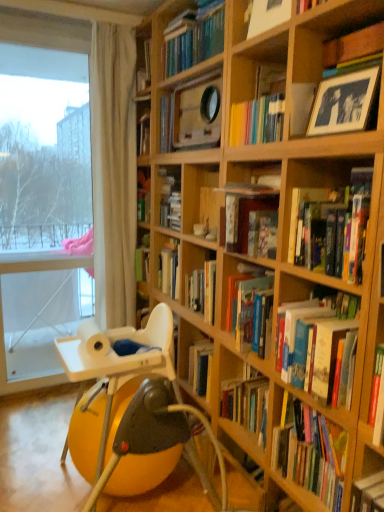
I want to click on blank space above transparent glass window at left (from a real-world perspective), so click(x=42, y=30).